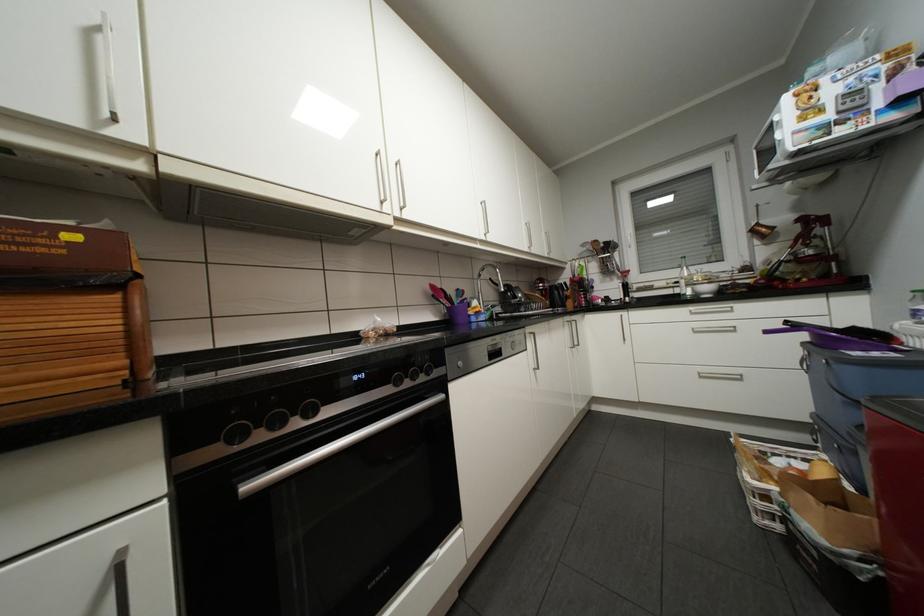
Locate an element on the screen. Image resolution: width=924 pixels, height=616 pixels. sink faucet handle is located at coordinates (487, 281).